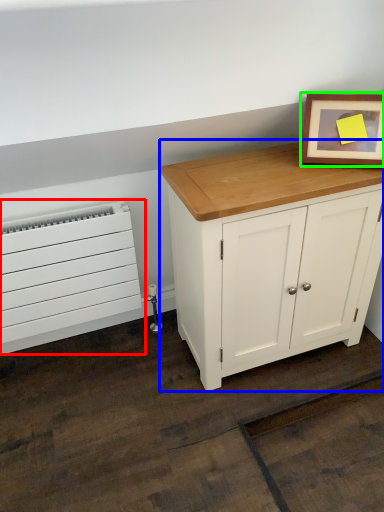
Question: Based on their relative distances, which object is nearer to heater (highlighted by a red box)? Choose from chest of drawers (highlighted by a blue box) and picture frame (highlighted by a green box).

Choices:
 (A) chest of drawers
 (B) picture frame

Answer: (A)